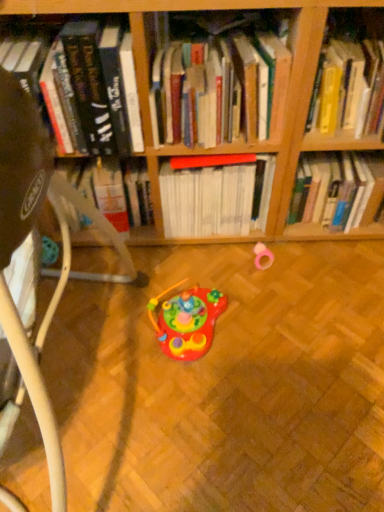
At what (x,y) coordinates should I click in order to perform the action: click on empty space that is to the right of shiny plastic toy at center, which is the first toy in left-to-right order. Please return your answer as a coordinate pair (x, y). The width and height of the screenshot is (384, 512). Looking at the image, I should click on (274, 327).